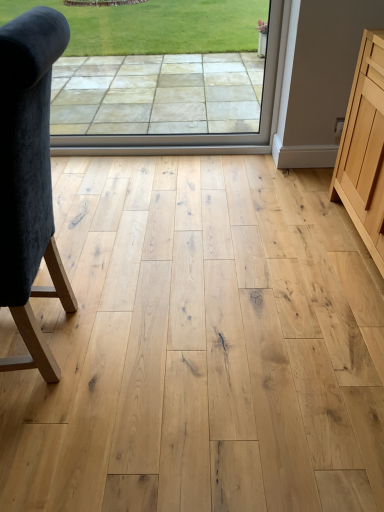
Image resolution: width=384 pixels, height=512 pixels. In order to click on free point to the left of natural wood cabinet at right in this screenshot , I will do `click(273, 258)`.